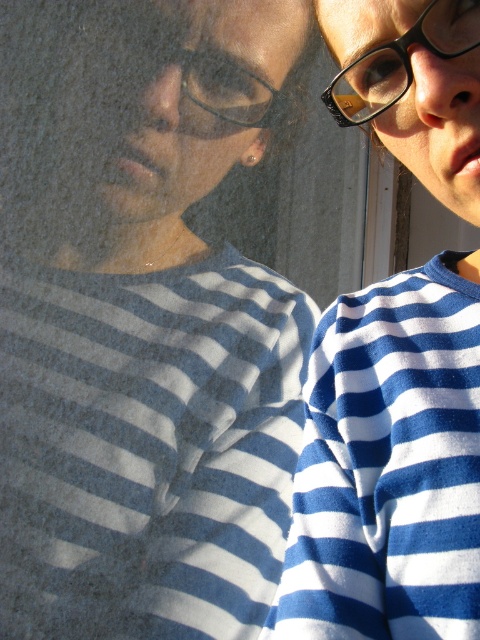
Question: Can you confirm if blue striped shirt at center is wider than black plastic glasses at upper center?

Choices:
 (A) yes
 (B) no

Answer: (A)

Question: Which point is farther to the camera?

Choices:
 (A) (385, 76)
 (B) (62, 483)
 (C) (229, 72)

Answer: (B)

Question: Is blue striped shirt at center bigger than blue striped sweater at center?

Choices:
 (A) no
 (B) yes

Answer: (B)

Question: Among these objects, which one is nearest to the camera?

Choices:
 (A) blue striped sweater at center
 (B) black plastic glasses at upper center
 (C) black plastic glasses at upper right

Answer: (C)

Question: Does blue striped shirt at center appear on the left side of black plastic glasses at upper right?

Choices:
 (A) no
 (B) yes

Answer: (B)

Question: Which point is closer to the camera taking this photo?

Choices:
 (A) (430, 29)
 (B) (299, 298)
 (C) (433, 529)

Answer: (A)